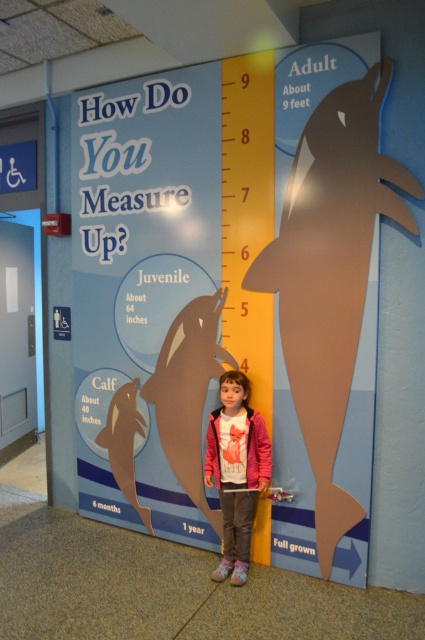
Is point (240, 67) positioned behind point (223, 486)?

No, it is not.

Can you confirm if yellow matte ruler at center is smaller than pink fleece jacket at center?

Incorrect, yellow matte ruler at center is not smaller in size than pink fleece jacket at center.

This screenshot has width=425, height=640. I want to click on yellow matte ruler at center, so click(248, 216).